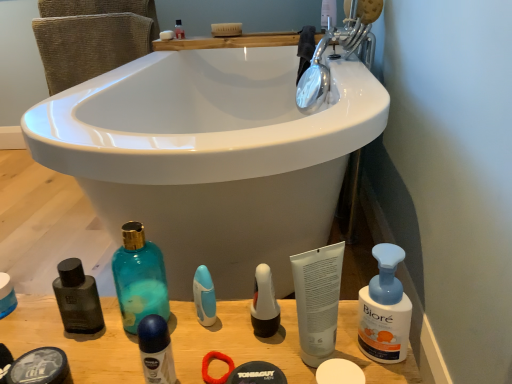
Identify the location of free space between blue matte deodorant at center, arranged as the fourth toiletry when viewed from the right, and white matte tube at center, arranged as the second toiletry when viewed from the top. (236, 361).